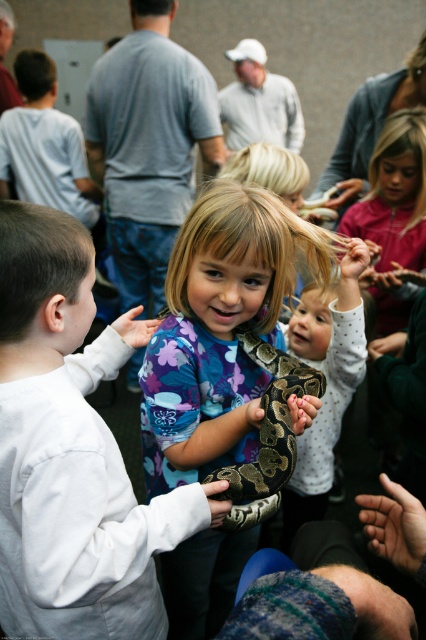
Question: Which point is closer to the camera?

Choices:
 (A) (175, 244)
 (B) (316, 304)
 (C) (89, 308)

Answer: (C)

Question: Is white soft shirt at center bigger than brown patterned snake at center?

Choices:
 (A) yes
 (B) no

Answer: (A)

Question: Among these points, which one is farthest from the camera?

Choices:
 (A) (316, 486)
 (B) (95, 476)

Answer: (A)

Question: Which of these objects is positioned closest to the white soft shirt at center?

Choices:
 (A) brown patterned snake at center
 (B) patterned dark green snake at center

Answer: (A)

Question: Can you confirm if floral-patterned shirt at center is positioned below patterned dark green snake at center?

Choices:
 (A) yes
 (B) no

Answer: (A)

Question: Is white soft shirt at center above brown patterned snake at center?

Choices:
 (A) yes
 (B) no

Answer: (B)